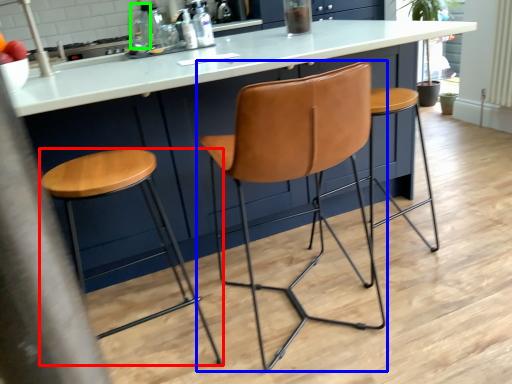
Question: Which object is positioned closest to stool (highlighted by a red box)? Select from chair (highlighted by a blue box) and bottle (highlighted by a green box).

Choices:
 (A) chair
 (B) bottle

Answer: (A)